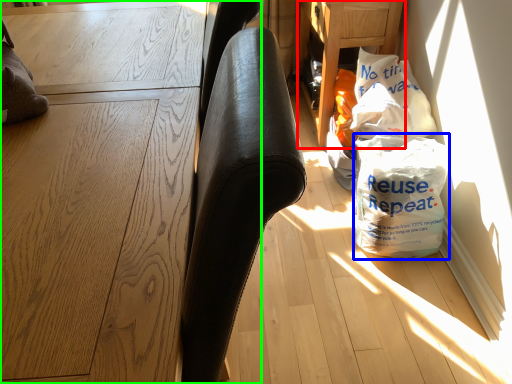
Question: Which object is the farthest from table (highlighted by a red box)? Choose among these: grocery bag (highlighted by a blue box) or furniture (highlighted by a green box).

Choices:
 (A) grocery bag
 (B) furniture

Answer: (B)